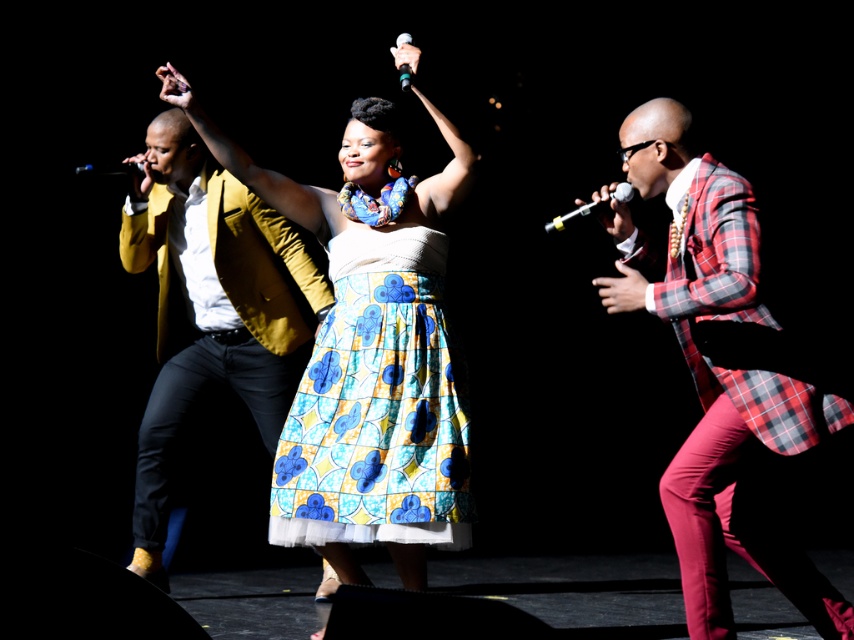
Which is behind, point (158, 422) or point (95, 168)?

Positioned behind is point (158, 422).

Is matte yellow blazer at left to the right of shiny black microphone at upper left from the viewer's perspective?

Correct, you'll find matte yellow blazer at left to the right of shiny black microphone at upper left.

Which is behind, point (132, 241) or point (79, 164)?

Positioned behind is point (79, 164).

Find the location of `matte yellow blazer at left`. matte yellow blazer at left is located at coordinates (209, 312).

Between blue and yellow printed fabric skirt at center and shiny black microphone at upper left, which one appears on the left side from the viewer's perspective?

shiny black microphone at upper left

Can you confirm if blue and yellow printed fabric skirt at center is taller than shiny black microphone at upper left?

Yes.

Find the location of a particular element. blue and yellow printed fabric skirt at center is located at coordinates (376, 404).

Where is `blue and yellow printed fabric skirt at center`? blue and yellow printed fabric skirt at center is located at coordinates (376, 404).

The image size is (854, 640). I want to click on metallic silver microphone at right, so click(591, 205).